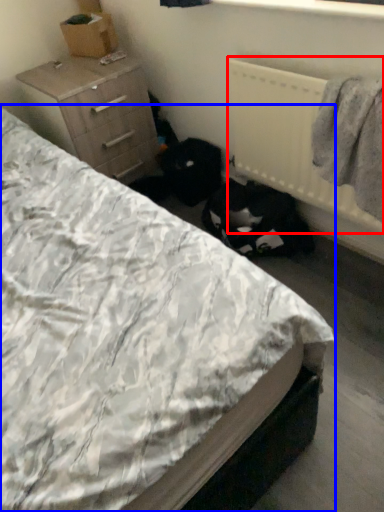
Question: Which of the following is the farthest to the observer, radiator (highlighted by a red box) or bed (highlighted by a blue box)?

Choices:
 (A) radiator
 (B) bed

Answer: (A)